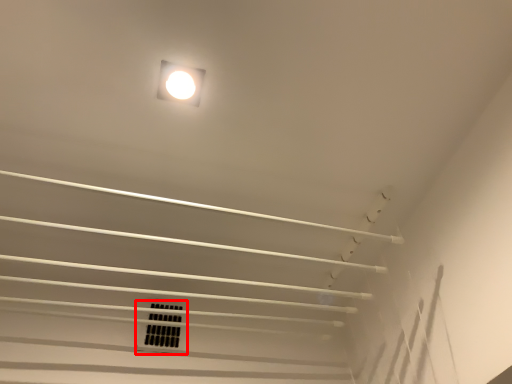
Question: From the image's perspective, where is window (annotated by the red box) located relative to lamp?

Choices:
 (A) above
 (B) below

Answer: (B)